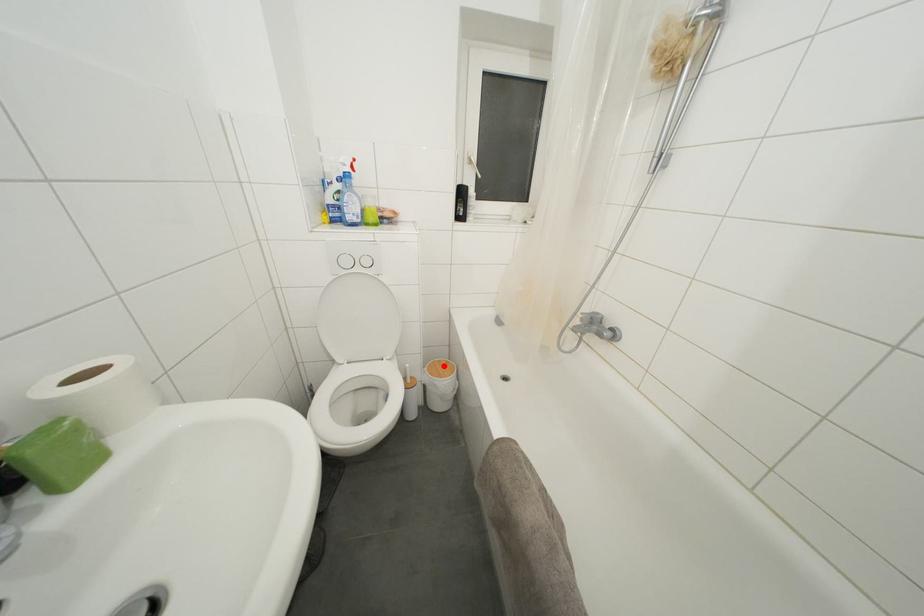
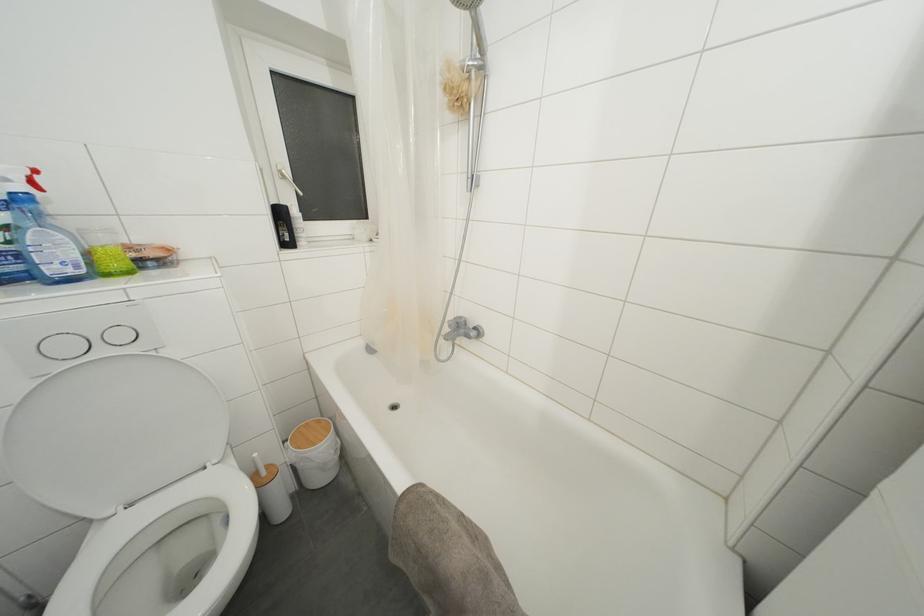
Question: I am providing you with two images of the same scene from different viewpoints. Image1 has a red point marked. In image2, the corresponding 3D location appears at what relative position? Reply with the corresponding letter.

Choices:
 (A) Closer
 (B) Farther

Answer: (B)